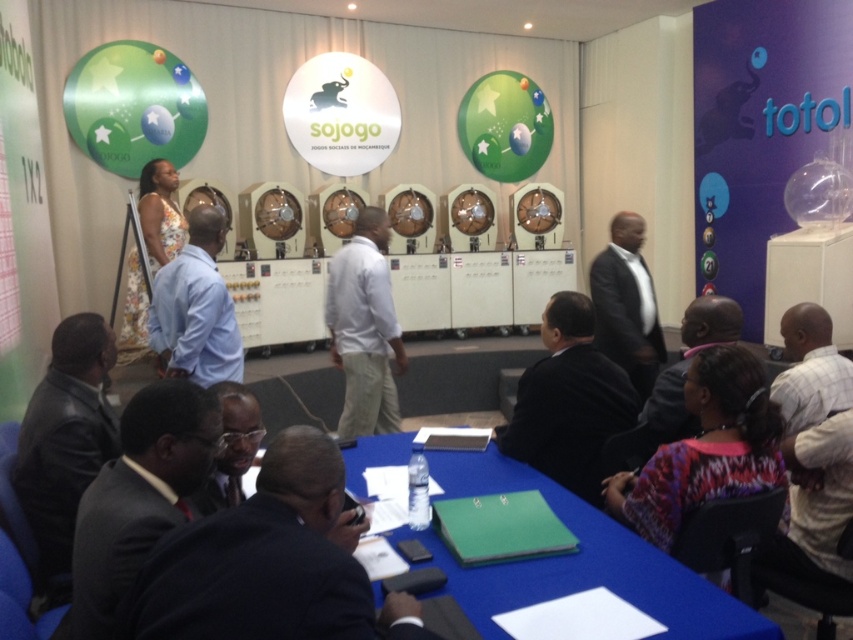
Question: Based on their relative distances, which object is farther from the dark suit at lower center?

Choices:
 (A) black leather jacket at lower left
 (B) light blue shirt at center
 (C) black suit at center

Answer: (B)

Question: Does black leather jacket at lower left have a greater width compared to light blue shirt at center?

Choices:
 (A) no
 (B) yes

Answer: (A)

Question: Which of the following is the closest to the observer?

Choices:
 (A) black leather jacket at lower left
 (B) black leather jacket at center

Answer: (A)

Question: From the image, what is the correct spatial relationship of plaid shirt at lower right in relation to dark brown suit at lower center?

Choices:
 (A) left
 (B) right

Answer: (B)

Question: Estimate the real-world distances between objects in this image. Which object is closer to the plaid shirt at lower right?

Choices:
 (A) black leather jacket at center
 (B) black suit at center

Answer: (B)

Question: Is the position of dark gray suit at lower left more distant than that of dark gray suit at center?

Choices:
 (A) yes
 (B) no

Answer: (B)